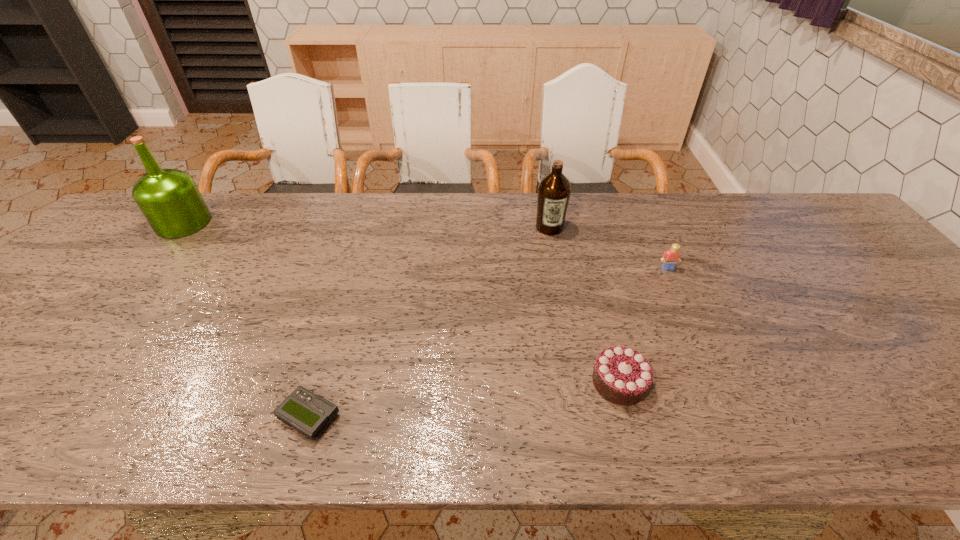
Where is `unoccupied area between the fourth object from right to left and the rightmost object`? unoccupied area between the fourth object from right to left and the rightmost object is located at coordinates (489, 343).

This screenshot has height=540, width=960. In order to click on vacant area that lies between the beeper and the leftmost object in this screenshot , I will do `click(246, 320)`.

Where is `object that is the closest to the left olive oil`? object that is the closest to the left olive oil is located at coordinates (308, 413).

Find the location of a particular element. This screenshot has width=960, height=540. object that ranks as the closest to the third nearest object is located at coordinates (554, 190).

Find the location of a particular element. The width and height of the screenshot is (960, 540). free point that satisfies the following two spatial constraints: 1. on the label of the chocolate cake; 2. on the right side of the shorter olive oil is located at coordinates (578, 382).

Identify the location of vacant space that satisfies the following two spatial constraints: 1. on the front side of the chocolate cake; 2. on the right side of the taller olive oil. (57, 382).